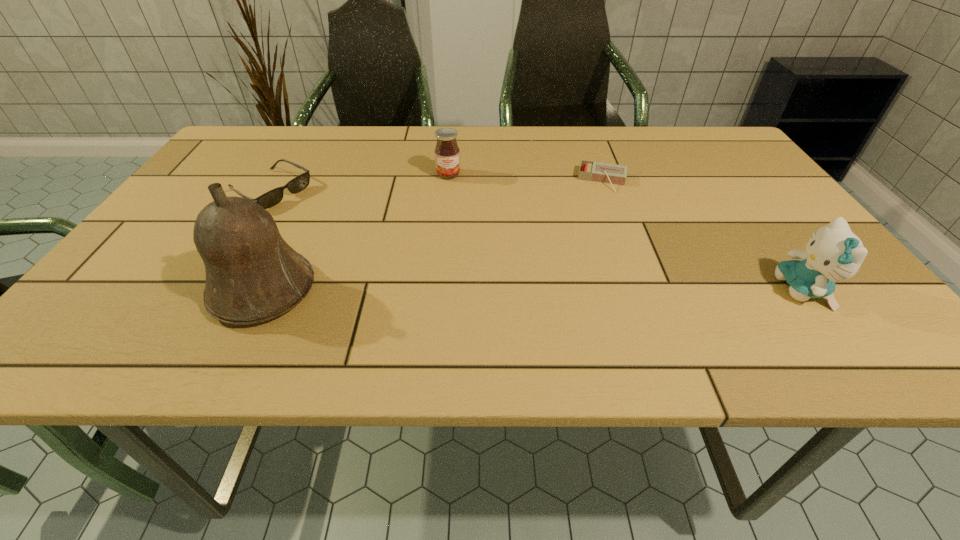
Find the location of `vacant space on the desktop that is between the bell and the kitten and is positioned on the striking surface of the shortest object`. vacant space on the desktop that is between the bell and the kitten and is positioned on the striking surface of the shortest object is located at coordinates (588, 291).

The width and height of the screenshot is (960, 540). In order to click on free space on the desktop that is between the tallest object and the rightmost object and is positioned on the label side of the jam in this screenshot , I will do `click(468, 291)`.

What are the coordinates of `free space on the desktop that is between the tallest object and the rightmost object and is positioned on the front-facing side of the sunglasses` in the screenshot? It's located at (461, 291).